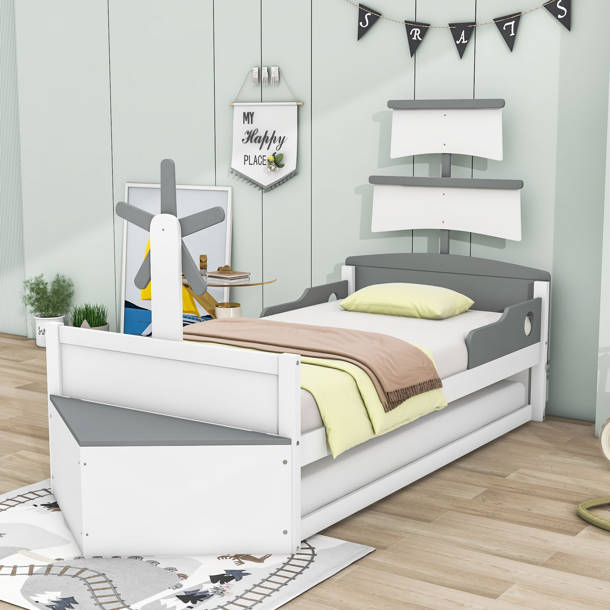
This screenshot has width=610, height=610. What are the coordinates of `sheet` in the screenshot? It's located at (445, 340).